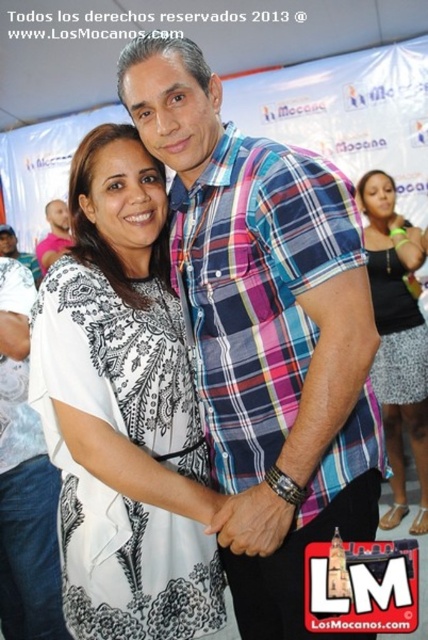
Does plaid cotton shirt at center appear under white printed blouse at center?

No.

From the picture: How much distance is there between plaid cotton shirt at center and white printed blouse at center?

plaid cotton shirt at center and white printed blouse at center are 8.12 inches apart.

What are the coordinates of `plaid cotton shirt at center` in the screenshot? It's located at (265, 332).

Does plaid cotton shirt at center appear over black textured dress at right?

Correct, plaid cotton shirt at center is located above black textured dress at right.

Image resolution: width=428 pixels, height=640 pixels. In order to click on plaid cotton shirt at center in this screenshot , I will do `click(265, 332)`.

How far apart are white printed blouse at center and black textured dress at right?

6.17 feet

Between white printed blouse at center and black textured dress at right, which one is positioned higher?

black textured dress at right

Where is `white printed blouse at center`? This screenshot has width=428, height=640. white printed blouse at center is located at coordinates (124, 410).